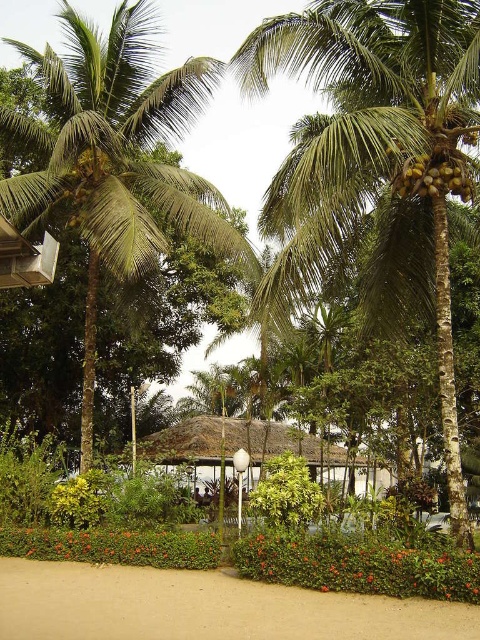
You are standing in the tropical garden and want to walk from the green leafy coconut tree at center to the sandy beach at lower center. Which direction should you move to get closer to the beach?

Since the green leafy coconut tree at center is further to the viewer than the sandy beach at lower center, you should move forward towards the beach to get closer.

You are standing at the point marked as point (308,134). You want to walk to the nearest palm tree. How far will you have to walk?

The distance between you and the nearest palm tree is 15.22 meters.

You are planning to set up a small picnic area in the garden. You need to place a picnic blanket between the green leafy palm tree at center and the thatched roof hut at center. Considering their widths, which object should you position closer to the narrower one to ensure the blanket fits comfortably?

The green leafy palm tree at center might be wider than the thatched roof hut at center, so you should position the picnic blanket closer to the thatched roof hut at center to accommodate the palm tree.